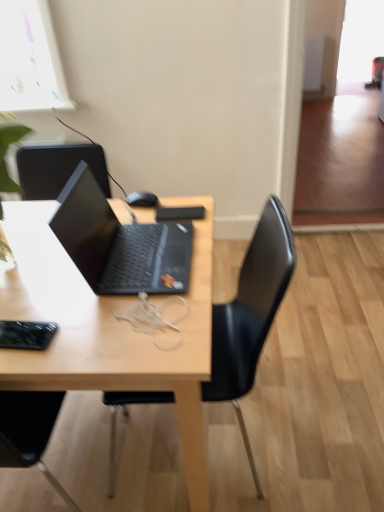
This screenshot has height=512, width=384. I want to click on free point in front of matte black laptop at center, so click(120, 328).